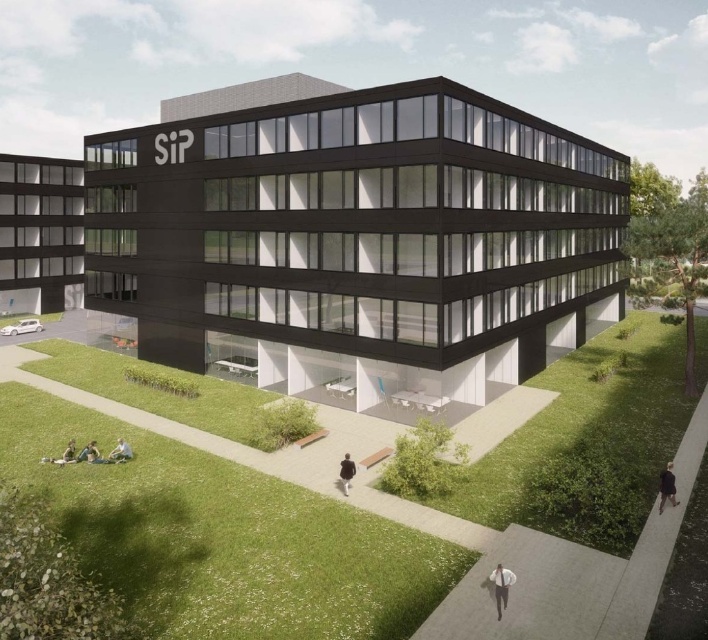
Question: From the image, what is the correct spatial relationship of black glass building at center in relation to black fabric jacket at lower right?

Choices:
 (A) below
 (B) above

Answer: (B)

Question: Can you confirm if black glass building at center is thinner than green fabric person at lower left?

Choices:
 (A) no
 (B) yes

Answer: (A)

Question: Which of the following is the farthest from the observer?

Choices:
 (A) (673, 483)
 (B) (491, 570)
 (C) (341, 464)

Answer: (C)

Question: Is white shirt at lower right wider than black matte jacket at center?

Choices:
 (A) yes
 (B) no

Answer: (B)

Question: Which point is farther to the camera?

Choices:
 (A) (113, 449)
 (B) (498, 108)

Answer: (B)

Question: Among these objects, which one is farthest from the camera?

Choices:
 (A) black matte jacket at center
 (B) black fabric jacket at lower right

Answer: (A)